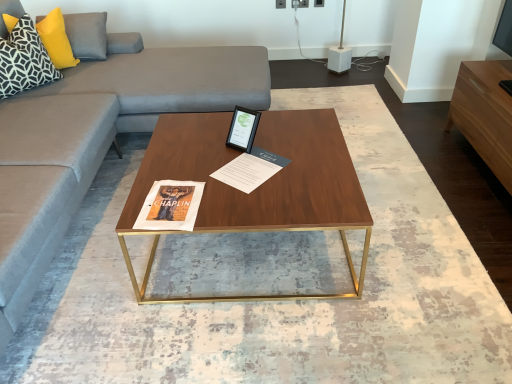
At what (x,y) coordinates should I click in order to perform the action: click on free space to the back side of matte black tablet at center. Please return your answer as a coordinate pair (x, y). This screenshot has width=512, height=384. Looking at the image, I should click on pos(230,122).